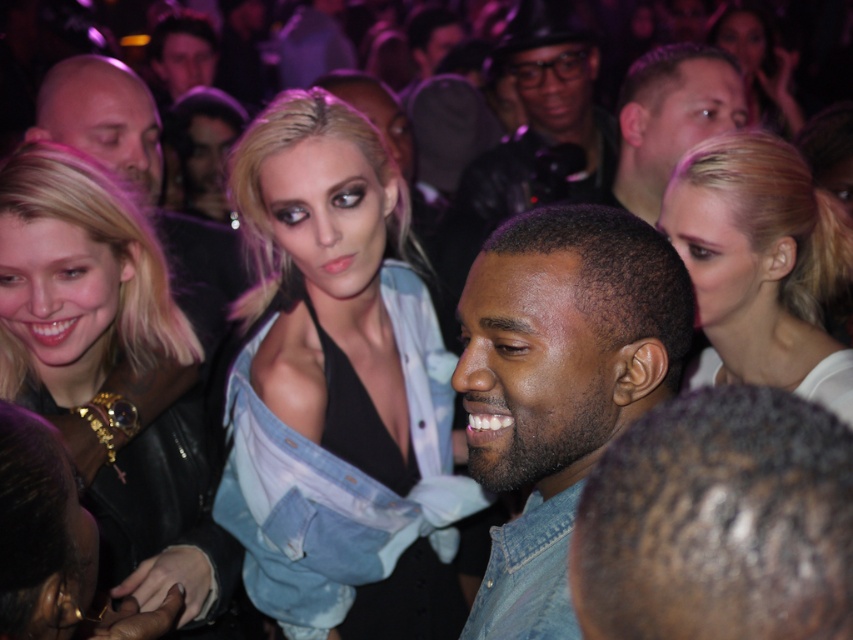
Question: Which point appears closest to the camera in this image?

Choices:
 (A) (688, 228)
 (B) (746, 36)
 (C) (630, 259)

Answer: (C)

Question: Is matte black leather jacket at center left wider than light brown hair at upper center?

Choices:
 (A) yes
 (B) no

Answer: (A)

Question: Which of these objects is positioned farthest from the denim shirt at center?

Choices:
 (A) blonde hair at upper right
 (B) denim jacket at center

Answer: (B)

Question: Does matte black leather jacket at upper center appear on the left side of matte black jacket at upper center?

Choices:
 (A) yes
 (B) no

Answer: (A)

Question: Considering the relative positions of denim jacket at center and denim shirt at center in the image provided, where is denim jacket at center located with respect to denim shirt at center?

Choices:
 (A) left
 (B) right

Answer: (A)

Question: Which point appears closest to the camera in this image?

Choices:
 (A) (187, 284)
 (B) (637, 163)
 (C) (364, 369)
 (D) (759, 16)

Answer: (C)